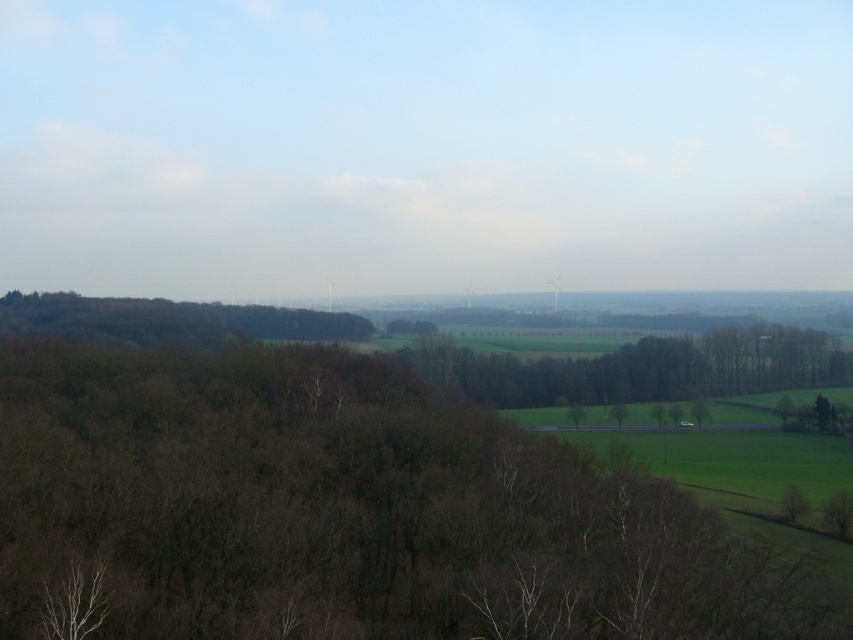
You are a hiker standing at the edge of the field looking towards the trees. Which tree group do you see first, the brown leafless tree at lower left or the dark brown textured trees at left?

The brown leafless tree at lower left is much taller than the dark brown textured trees at left, so you will see the brown leafless tree at lower left first because it is taller and stands out more in the foreground.

You are standing in the rural landscape and want to take a photo of the brown leafless tree at lower left and the dark brown textured trees at left. Which tree group should you focus on first to ensure both are in sharp focus?

You should focus on the brown leafless tree at lower left first because it is closer to you than the dark brown textured trees at left. By focusing on the closer tree, the farther ones will still be in focus due to depth of field.